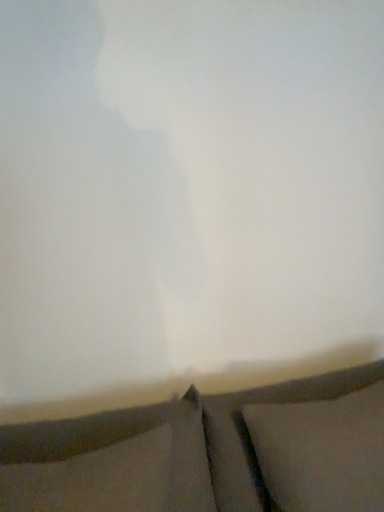
Question: From a real-world perspective, is dark gray fabric pillow at lower center, the first pillow in the left-to-right sequence, positioned above or below white soft pillow at lower right, which is the 2th pillow from left to right?

Choices:
 (A) above
 (B) below

Answer: (A)

Question: Is dark gray fabric pillow at lower center, the first pillow in the left-to-right sequence, bigger or smaller than white soft pillow at lower right, the first pillow in the right-to-left sequence?

Choices:
 (A) small
 (B) big

Answer: (A)

Question: Which of these objects is positioned farthest from the dark gray fabric pillow at lower center, the first pillow in the left-to-right sequence?

Choices:
 (A) textured gray curtain at bottom
 (B) white soft pillow at lower right, the first pillow in the right-to-left sequence

Answer: (B)

Question: Which object is the farthest from the dark gray fabric pillow at lower center, positioned as the 2th pillow in right-to-left order?

Choices:
 (A) white soft pillow at lower right, the first pillow in the right-to-left sequence
 (B) textured gray curtain at bottom

Answer: (A)